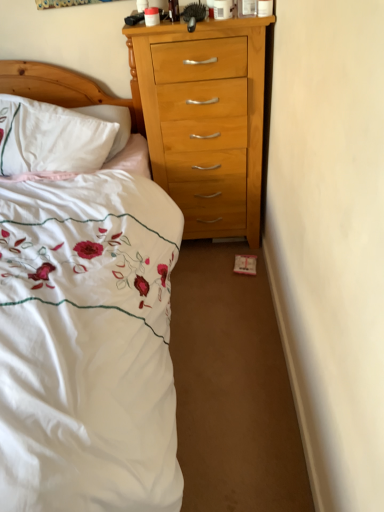
Question: Would you say white soft pillow at left is inside or outside white embroidered bed at left?

Choices:
 (A) inside
 (B) outside

Answer: (A)

Question: Based on their positions, is white soft pillow at left located to the left or right of white embroidered bed at left?

Choices:
 (A) right
 (B) left

Answer: (B)

Question: From their relative heights in the image, would you say white soft pillow at left is taller or shorter than white embroidered bed at left?

Choices:
 (A) tall
 (B) short

Answer: (B)

Question: Visually, is white embroidered bed at left positioned to the left or to the right of white soft pillow at left?

Choices:
 (A) right
 (B) left

Answer: (A)

Question: From a real-world perspective, is white embroidered bed at left physically located above or below white soft pillow at left?

Choices:
 (A) above
 (B) below

Answer: (B)

Question: Does point (77, 228) appear closer or farther from the camera than point (107, 154)?

Choices:
 (A) closer
 (B) farther

Answer: (A)

Question: From the image's perspective, relative to white soft pillow at left, is white embroidered bed at left above or below?

Choices:
 (A) below
 (B) above

Answer: (A)